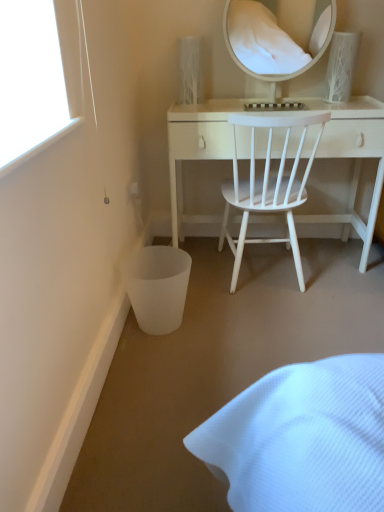
The width and height of the screenshot is (384, 512). I want to click on vacant space situated on the left part of white glossy mirror at upper center, so click(222, 104).